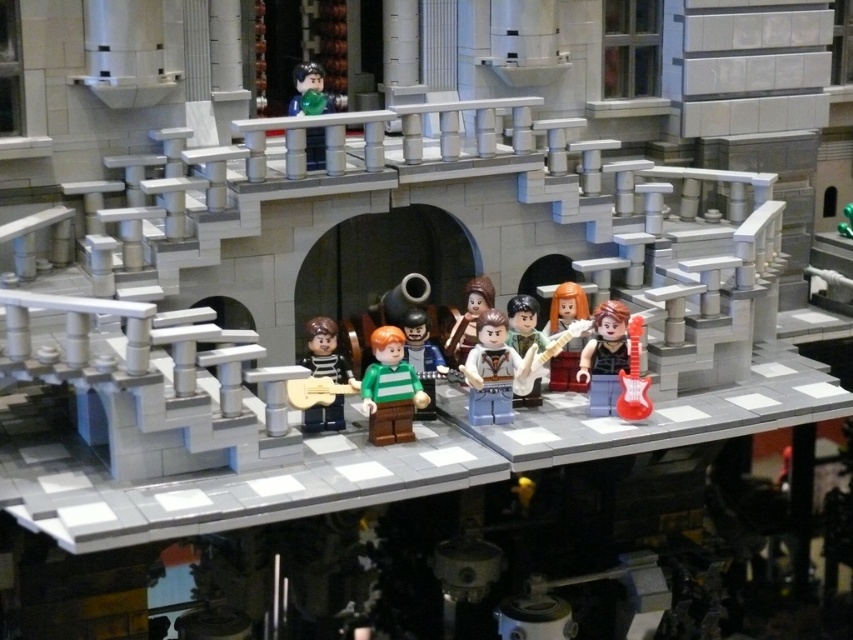
Question: Can you confirm if striped fabric guitar at center is smaller than smooth green shirt at center?

Choices:
 (A) no
 (B) yes

Answer: (B)

Question: Among these objects, which one is farthest from the camera?

Choices:
 (A) smooth green shirt at center
 (B) shiny black guitar at right
 (C) smooth plastic guitar at center
 (D) glossy red electric guitar at lower right

Answer: (C)

Question: From the image, what is the correct spatial relationship of green matte figure at center in relation to smooth brown guitar at center?

Choices:
 (A) above
 (B) below

Answer: (B)

Question: Which point appears closest to the camera in this image?

Choices:
 (A) (421, 330)
 (B) (318, 68)
 (C) (427, 397)
 (D) (328, 330)

Answer: (C)

Question: Does smooth brown guitar at center have a lesser width compared to smooth green shirt at center?

Choices:
 (A) no
 (B) yes

Answer: (A)

Question: Which of the following is the closest to the observer?

Choices:
 (A) [x=515, y=317]
 (B) [x=502, y=371]
 (C) [x=329, y=348]
 (D) [x=477, y=298]

Answer: (B)